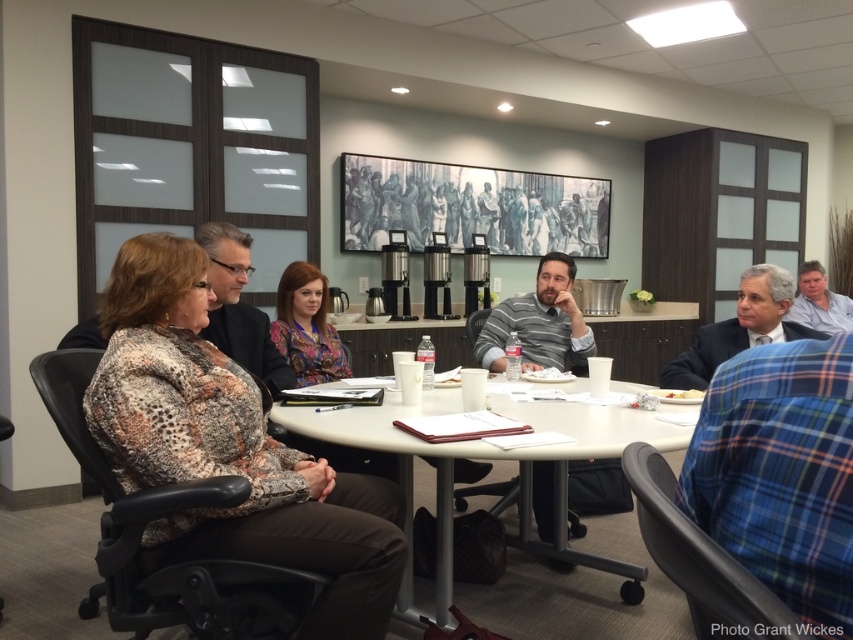
Is printed fabric blouse at left positioned behind white plastic table at center?

No.

Measure the distance between printed fabric blouse at left and camera.

They are 1.40 meters apart.

At what (x,y) coordinates should I click in order to perform the action: click on printed fabric blouse at left. Please return your answer as a coordinate pair (x, y). The height and width of the screenshot is (640, 853). Looking at the image, I should click on (229, 449).

Based on the photo, who is more forward, (x=575, y=452) or (x=762, y=321)?

Point (x=575, y=452) is more forward.

Which is in front, point (654, 426) or point (724, 344)?

Point (654, 426) is in front.

You are a GUI agent. You are given a task and a screenshot of the screen. Output one action in this format:
    pyautogui.click(x=<x>, y=<y>)
    Task: Click on the white plastic table at center
    The height and width of the screenshot is (640, 853).
    Given the screenshot: What is the action you would take?
    pyautogui.click(x=492, y=460)

How distant is printed fabric blouse at left from blue shirt at right?

The distance of printed fabric blouse at left from blue shirt at right is 4.53 meters.

From the picture: Who is more forward, (x=184, y=317) or (x=798, y=305)?

Point (x=184, y=317)

Who is more forward, [144,269] or [798,280]?

Point [144,269] is in front.

The height and width of the screenshot is (640, 853). What are the coordinates of `printed fabric blouse at left` in the screenshot? It's located at (229, 449).